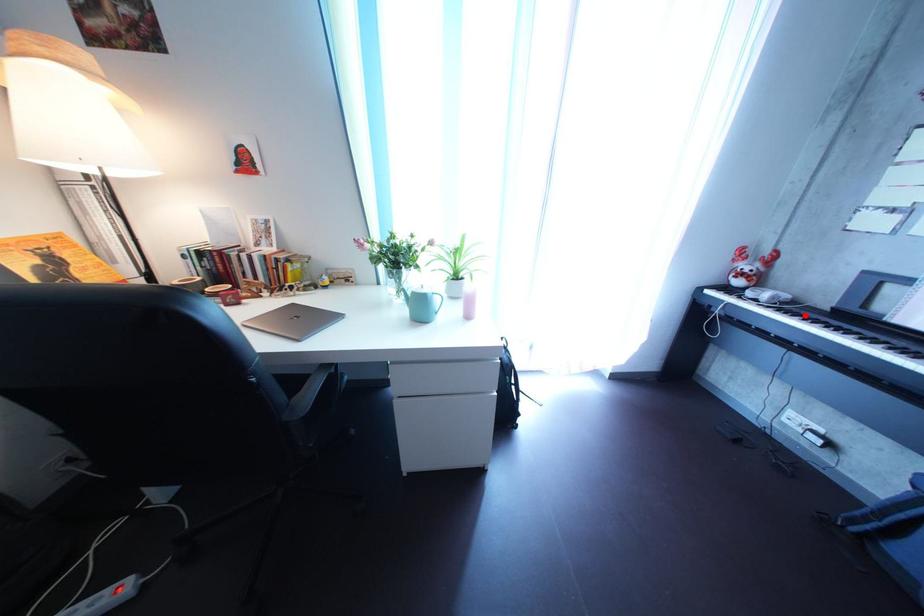
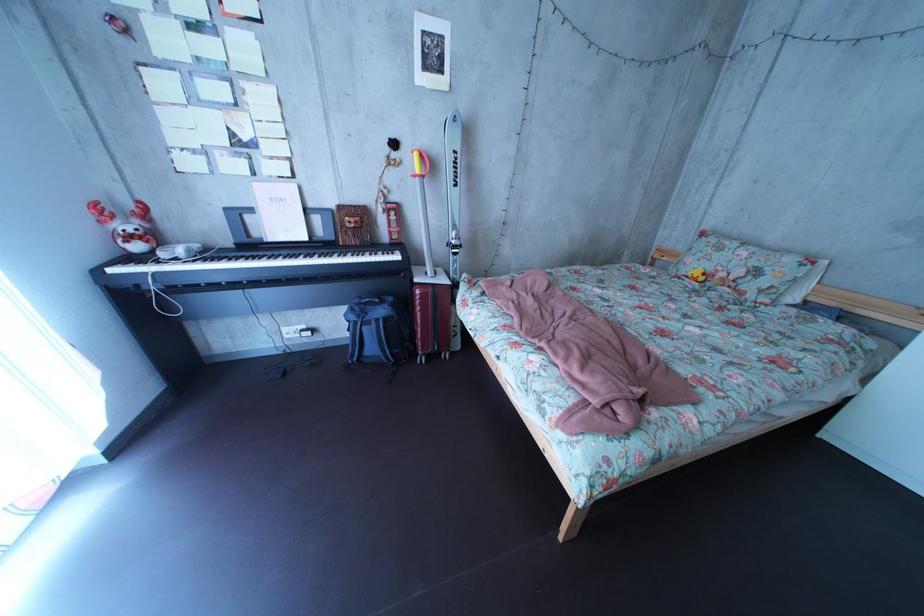
Question: I am providing you with two images of the same scene from different viewpoints. Image1 has a red point marked. In image2, the corresponding 3D location appears at what relative position? Reply with the corresponding letter.

Choices:
 (A) Closer
 (B) Farther

Answer: (A)